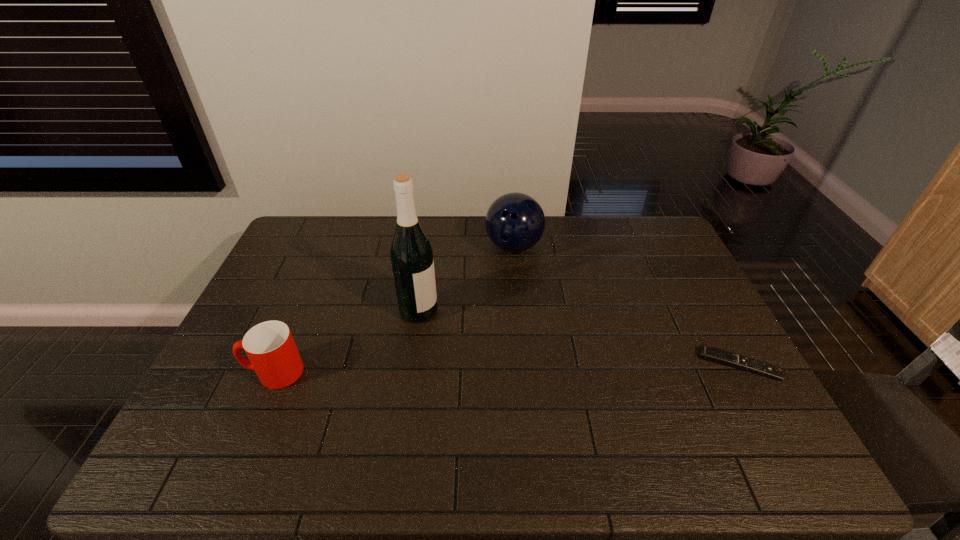
In the image, there is a desktop. Where is `vacant space at the left edge`? The image size is (960, 540). vacant space at the left edge is located at coordinates (299, 318).

The image size is (960, 540). In the image, there is a desktop. Find the location of `vacant space at the right edge`. vacant space at the right edge is located at coordinates (714, 392).

Find the location of `vacant space at the near left corner of the desktop`. vacant space at the near left corner of the desktop is located at coordinates (197, 423).

This screenshot has height=540, width=960. I want to click on free space between the leftmost object and the rightmost object, so click(507, 368).

This screenshot has width=960, height=540. In order to click on free area in between the farthest object and the tallest object in this screenshot , I will do `click(467, 279)`.

Where is `vacant space that's between the tallest object and the second shortest object`? The image size is (960, 540). vacant space that's between the tallest object and the second shortest object is located at coordinates [x=347, y=341].

Image resolution: width=960 pixels, height=540 pixels. I want to click on free space between the second farthest object and the cup, so click(347, 341).

This screenshot has height=540, width=960. In order to click on free space between the rightmost object and the tallest object in this screenshot , I will do `click(579, 338)`.

Locate an element on the screen. The height and width of the screenshot is (540, 960). vacant region between the wine bottle and the rightmost object is located at coordinates (579, 338).

The width and height of the screenshot is (960, 540). What are the coordinates of `vacant area between the rightmost object and the second shortest object` in the screenshot? It's located at (507, 368).